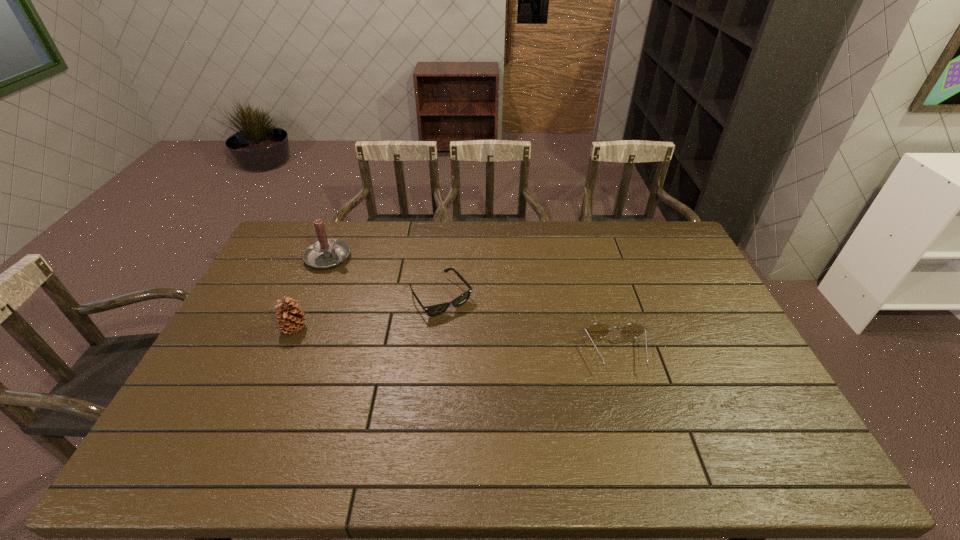
Find the location of a particular element. The image size is (960, 540). vacant region located on the side of the tallest object with the handle loop is located at coordinates (414, 308).

Where is `free space located on the front-facing side of the sunglasses`? free space located on the front-facing side of the sunglasses is located at coordinates (522, 401).

The image size is (960, 540). Identify the location of blank area located on the front-facing side of the sunglasses. (534, 415).

Locate an element on the screen. The width and height of the screenshot is (960, 540). free space located on the front-facing side of the sunglasses is located at coordinates (519, 398).

Identify the location of object present at the far edge. (326, 253).

The height and width of the screenshot is (540, 960). Find the location of `pinecone that is at the left edge`. pinecone that is at the left edge is located at coordinates (291, 319).

Image resolution: width=960 pixels, height=540 pixels. Find the location of `candle that is positioned at the left edge`. candle that is positioned at the left edge is located at coordinates (326, 253).

I want to click on object that is at the far left corner, so (326, 253).

At what (x,y) coordinates should I click in order to perform the action: click on vacant space at the far edge. Please return your answer as a coordinate pair (x, y). This screenshot has width=960, height=540. Looking at the image, I should click on (424, 252).

In the image, there is a desktop. Where is `free space at the near edge`? The width and height of the screenshot is (960, 540). free space at the near edge is located at coordinates (490, 410).